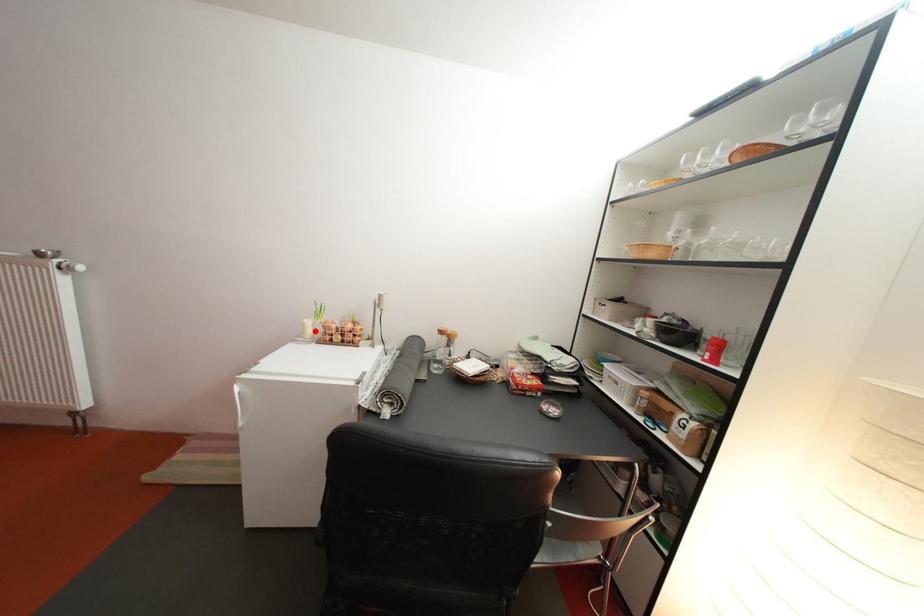
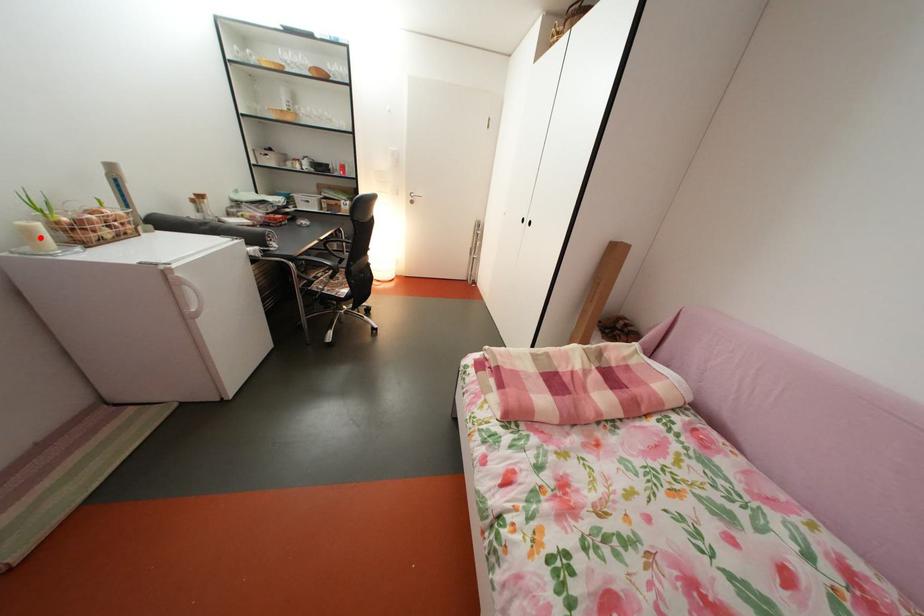
I am providing you with two images of the same scene from different viewpoints. A red point is marked on the first image and another point is marked on the second image. Are the points marked in image1 and image2 representing the same 3D position?

Yes